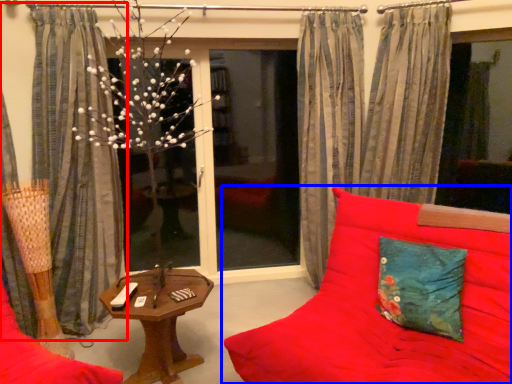
Question: Among these objects, which one is nearest to the camera, curtain (highlighted by a red box) or studio couch (highlighted by a blue box)?

Choices:
 (A) curtain
 (B) studio couch

Answer: (B)